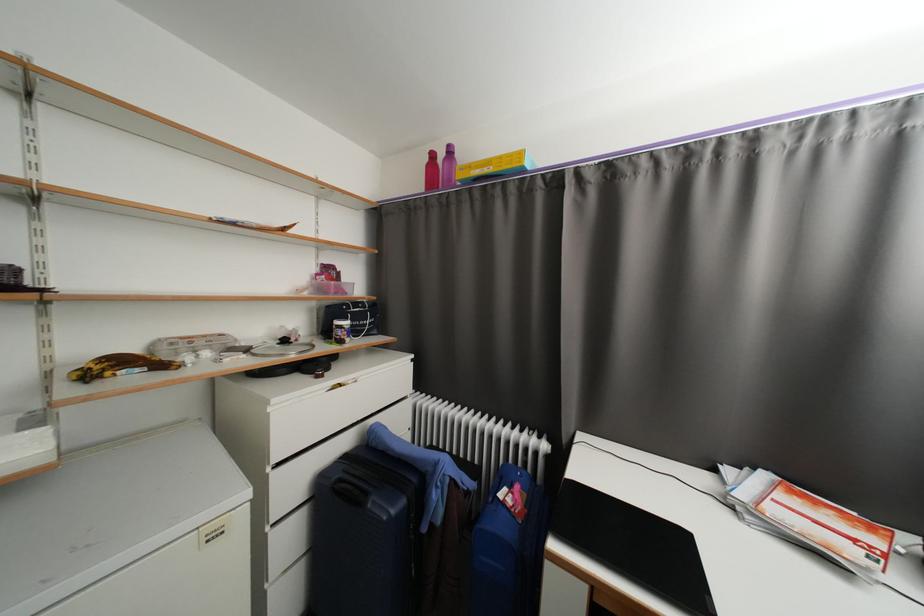
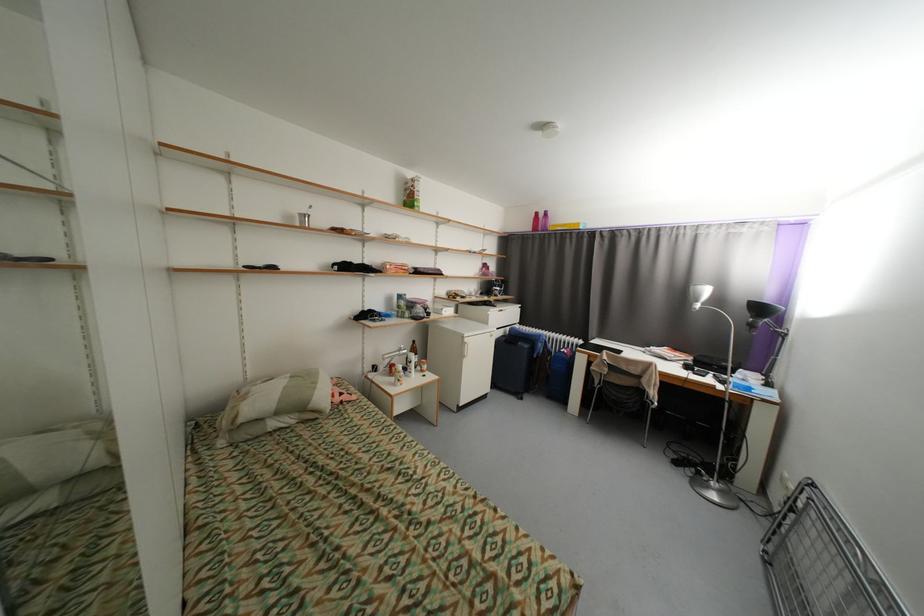
Question: Which direction would the cameraman need to move to produce the second image? Reply with the corresponding letter.

Choices:
 (A) Left
 (B) Right
 (C) Forward
 (D) Backward

Answer: (D)